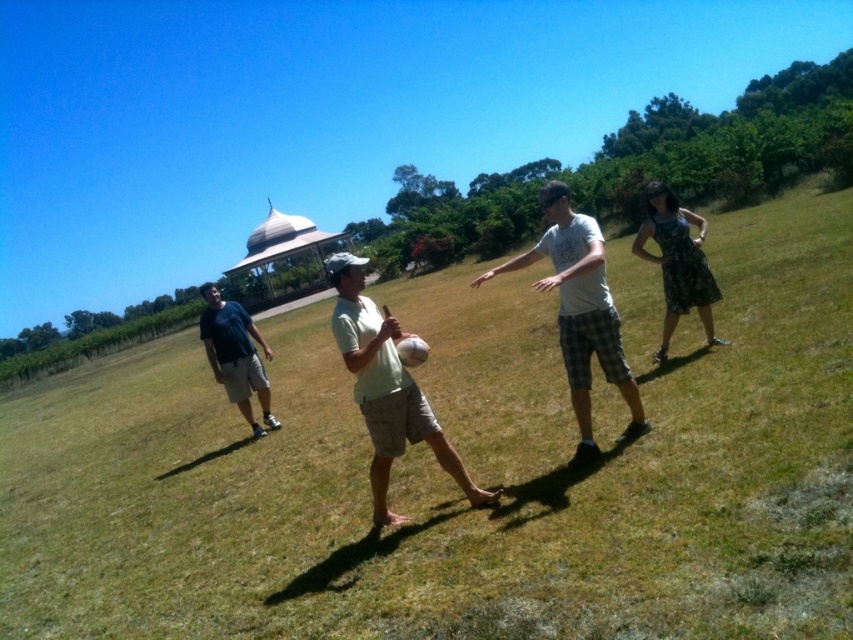
Question: Which point is farther from the camera taking this photo?

Choices:
 (A) (311, 397)
 (B) (241, 339)

Answer: (A)

Question: Can you confirm if green grassy field at center is positioned to the left of dark blue t-shirt at left?

Choices:
 (A) no
 (B) yes

Answer: (A)

Question: Among these objects, which one is farthest from the camera?

Choices:
 (A) green grassy field at center
 (B) dark blue t-shirt at left
 (C) light green fabric shirt at center
 (D) white cotton shirt at center

Answer: (B)

Question: Is green grassy field at center above light green fabric shirt at center?

Choices:
 (A) yes
 (B) no

Answer: (A)

Question: Is white cotton shirt at center bigger than light green fabric shirt at center?

Choices:
 (A) yes
 (B) no

Answer: (A)

Question: Which object is closer to the camera taking this photo?

Choices:
 (A) white cotton shirt at center
 (B) light green fabric shirt at center
 (C) green grassy field at center

Answer: (C)